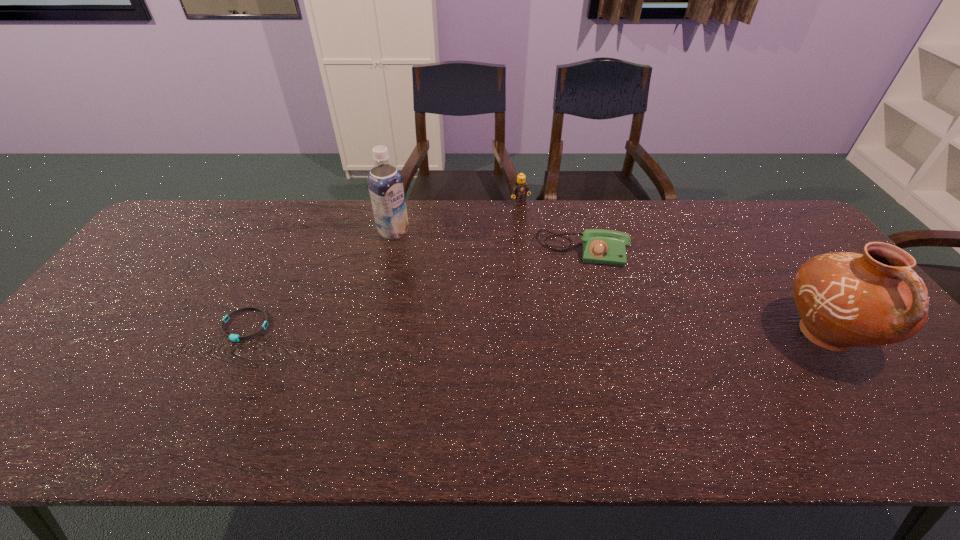
At what (x,y) coordinates should I click in order to perform the action: click on free space on the desktop that is between the wristband and the pottery and is positioned on the label of the soya milk. Please return your answer as a coordinate pair (x, y). This screenshot has width=960, height=540. Looking at the image, I should click on (545, 330).

Find the location of a particular element. This screenshot has width=960, height=540. free space on the desktop that is between the leftmost object and the rightmost object and is positioned on the dial of the fourth tallest object is located at coordinates (581, 331).

Where is `vacant spot on the desktop that is between the leftmost object and the rightmost object and is positioned in front of the Lego`? The width and height of the screenshot is (960, 540). vacant spot on the desktop that is between the leftmost object and the rightmost object and is positioned in front of the Lego is located at coordinates (615, 331).